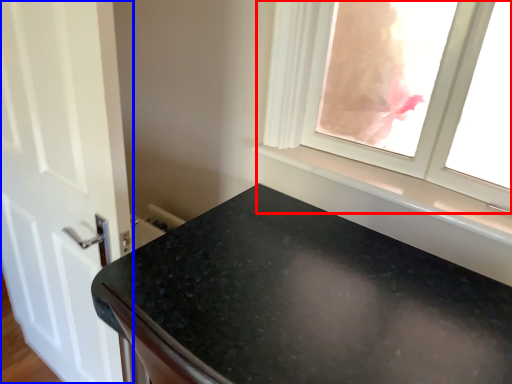
Question: Among these objects, which one is farthest to the camera, window (highlighted by a red box) or door (highlighted by a blue box)?

Choices:
 (A) window
 (B) door

Answer: (B)